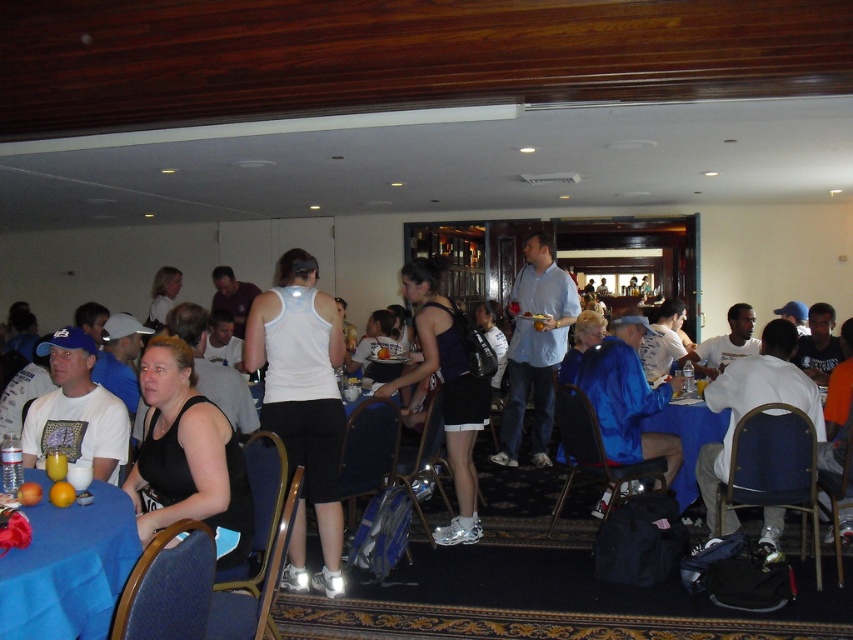
Does white fabric shirt at right have a smaller size compared to matte white t-shirt at left?

No.

Is white fabric shirt at right taller than matte white t-shirt at left?

Yes.

Is point (791, 332) positioned in front of point (78, 406)?

No, it is not.

Locate an element on the screen. white fabric shirt at right is located at coordinates (750, 410).

Which is below, white matte tank top at center or white cotton shirt at center?

white matte tank top at center is below.

Can you confirm if white matte tank top at center is positioned to the right of white cotton shirt at center?

No, white matte tank top at center is not to the right of white cotton shirt at center.

Is point (323, 385) less distant than point (548, 280)?

Yes.

You are a GUI agent. You are given a task and a screenshot of the screen. Output one action in this format:
    pyautogui.click(x=<x>, y=<y>)
    Task: Click on the white matte tank top at center
    This screenshot has height=640, width=853.
    Given the screenshot: What is the action you would take?
    pyautogui.click(x=302, y=403)

Between blue fabric table at lower left and white cotton shirt at center, which one is positioned higher?

Positioned higher is white cotton shirt at center.

The width and height of the screenshot is (853, 640). What do you see at coordinates (68, 566) in the screenshot? I see `blue fabric table at lower left` at bounding box center [68, 566].

Find the location of a particular element. Image resolution: width=853 pixels, height=640 pixels. blue fabric table at lower left is located at coordinates (68, 566).